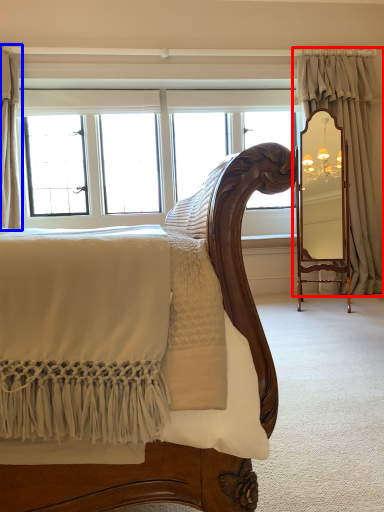
Question: Which of the following is the farthest to the observer, curtain (highlighted by a red box) or curtain (highlighted by a blue box)?

Choices:
 (A) curtain
 (B) curtain

Answer: (A)